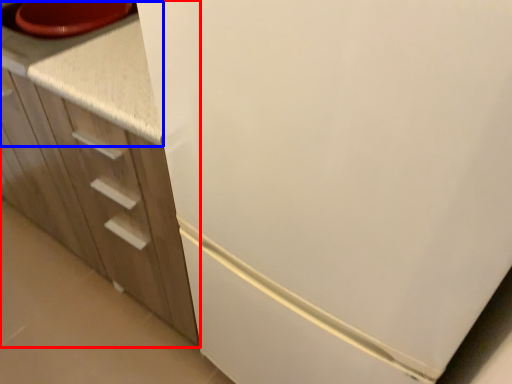
Question: Which point is further to the camera, cabinetry (highlighted by a red box) or counter top (highlighted by a blue box)?

Choices:
 (A) cabinetry
 (B) counter top

Answer: (B)